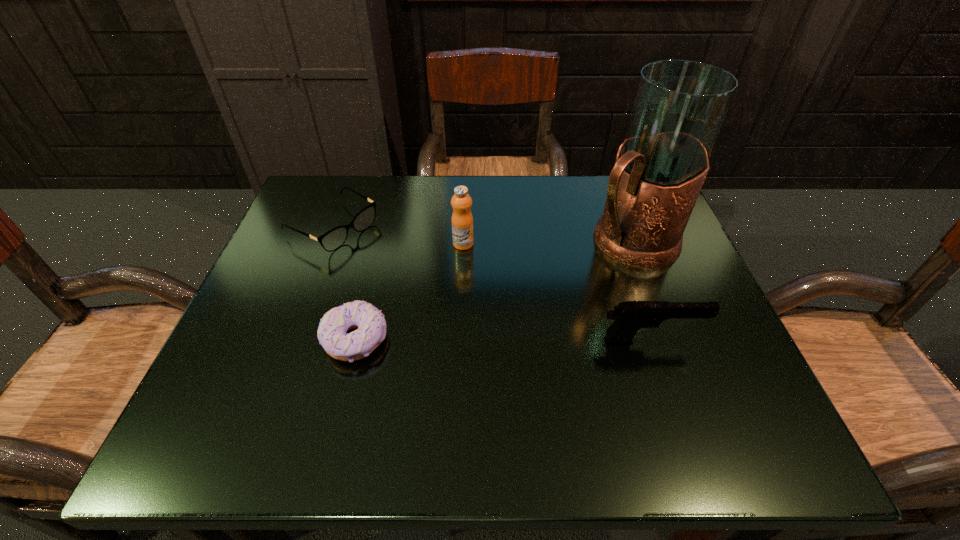
In order to click on vacant area situated 0.210m on the front label of the third object from right to left in this screenshot , I will do `click(522, 313)`.

This screenshot has width=960, height=540. Find the location of `free spot located 0.340m on the front label of the third object from right to left`. free spot located 0.340m on the front label of the third object from right to left is located at coordinates (564, 362).

Locate an element on the screen. This screenshot has height=540, width=960. blank area located on the front label of the third object from right to left is located at coordinates (528, 320).

This screenshot has width=960, height=540. Identify the location of free point located on the front-facing side of the spectacles. (492, 317).

I want to click on free space located on the front-facing side of the spectacles, so click(410, 271).

The width and height of the screenshot is (960, 540). What are the coordinates of `blank space located 0.270m on the front-facing side of the spectacles` in the screenshot? It's located at (459, 298).

Where is `pitcher located at the far edge`? pitcher located at the far edge is located at coordinates click(x=679, y=107).

You are a GUI agent. You are given a task and a screenshot of the screen. Output one action in this format:
    pyautogui.click(x=<x>, y=<y>)
    Task: Click on the spectacles that is at the far edge
    Image resolution: width=960 pixels, height=540 pixels.
    Given the screenshot: What is the action you would take?
    pyautogui.click(x=333, y=239)

You are a GUI agent. You are given a task and a screenshot of the screen. Output one action in this format:
    pyautogui.click(x=<x>, y=<y>)
    Task: Click on the object located in the near edge section of the desktop
    
    Given the screenshot: What is the action you would take?
    coord(370,323)

Where is `object located in the left edge section of the desktop`? This screenshot has height=540, width=960. object located in the left edge section of the desktop is located at coordinates (333, 239).